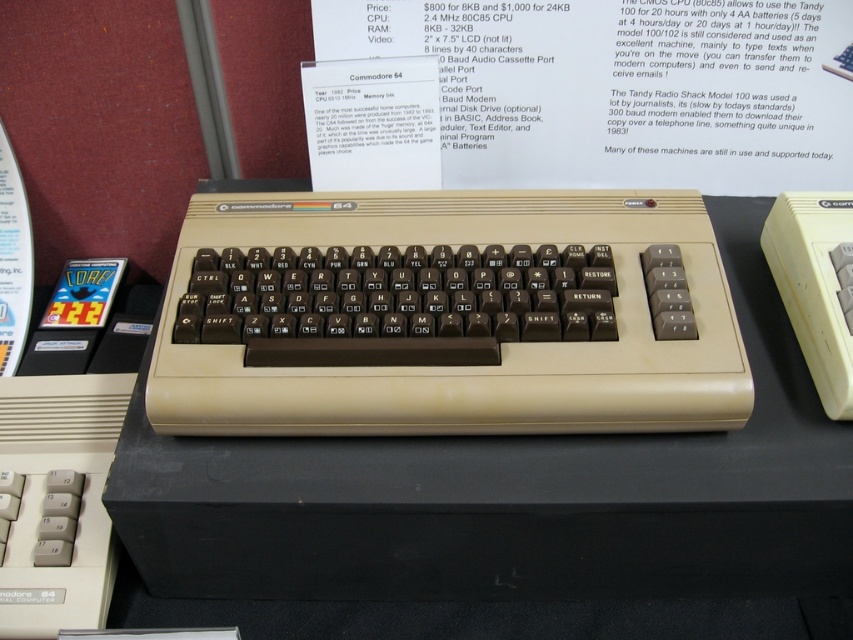
Does point (148, 394) lie in front of point (523, 481)?

No.

The image size is (853, 640). What do you see at coordinates (445, 316) in the screenshot?
I see `beige plastic keyboard at center` at bounding box center [445, 316].

At what (x,y) coordinates should I click in order to perform the action: click on beige plastic keyboard at center. Please return your answer as a coordinate pair (x, y). Looking at the image, I should click on (445, 316).